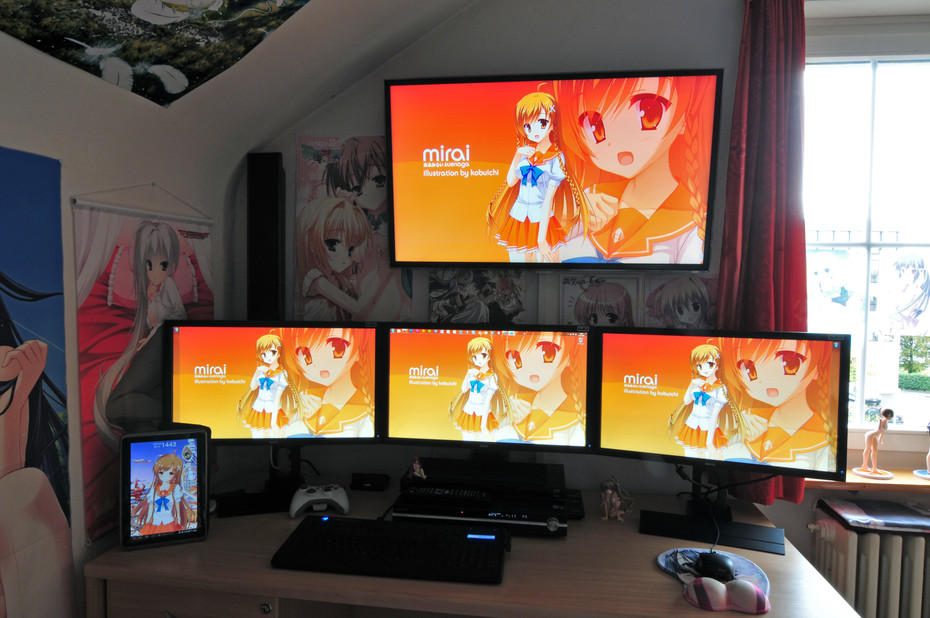
You are a GUI agent. You are given a task and a screenshot of the screen. Output one action in this format:
    pyautogui.click(x=<x>, y=<y>)
    Task: Click on the tv
    The image size is (930, 618).
    Given the screenshot: What is the action you would take?
    pyautogui.click(x=565, y=227)